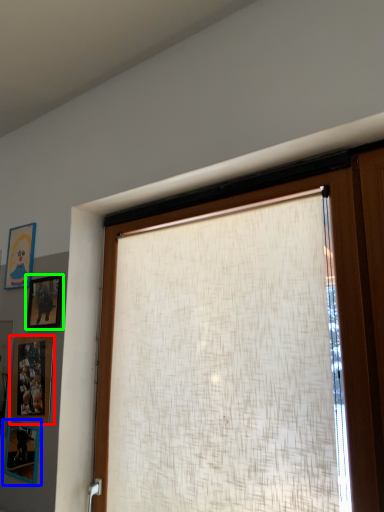
Question: Based on their relative distances, which object is nearer to picture frame (highlighted by a red box)? Choose from picture frame (highlighted by a blue box) and picture frame (highlighted by a green box).

Choices:
 (A) picture frame
 (B) picture frame

Answer: (A)